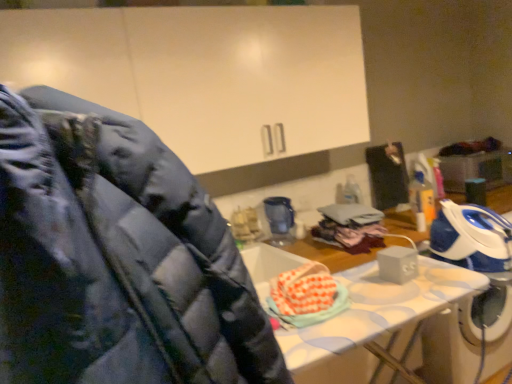
You are a GUI agent. You are given a task and a screenshot of the screen. Output one action in this format:
    pyautogui.click(x=<x>, y=<y>)
    Task: Click on the blue plastic blender at center
    The image size is (512, 384).
    Given the screenshot: What is the action you would take?
    [x=279, y=220]

What do you see at coordinates (279, 220) in the screenshot?
I see `blue plastic blender at center` at bounding box center [279, 220].

Locate an element on the screen. Image resolution: width=512 pixels, height=384 pixels. black fabric suit at upper right is located at coordinates (387, 175).

What is the approximate width of black fabric suit at upper right?

The width of black fabric suit at upper right is 5.65 inches.

What do you see at coordinates (387, 175) in the screenshot?
I see `black fabric suit at upper right` at bounding box center [387, 175].

I want to click on blue plastic blender at center, so click(279, 220).

Considering the positions of objects blue plastic blender at center and black fabric suit at upper right in the image provided, who is more to the left, blue plastic blender at center or black fabric suit at upper right?

blue plastic blender at center.

Is blue plastic blender at center in front of black fabric suit at upper right?

Yes, blue plastic blender at center is closer to the viewer.

Which is in front, point (272, 233) or point (396, 168)?

Positioned in front is point (272, 233).

From the image's perspective, is blue plastic blender at center located above or below black fabric suit at upper right?

blue plastic blender at center is below black fabric suit at upper right.

From a real-world perspective, who is located lower, blue plastic blender at center or black fabric suit at upper right?

In real-world perspective, blue plastic blender at center is lower.

Can you confirm if blue plastic blender at center is thinner than black fabric suit at upper right?

No.

Can you confirm if blue plastic blender at center is shorter than black fabric suit at upper right?

Yes.

Between blue plastic blender at center and black fabric suit at upper right, which one has smaller size?

Smaller between the two is blue plastic blender at center.

Does blue plastic blender at center contain black fabric suit at upper right?

No, black fabric suit at upper right is not inside blue plastic blender at center.

Is blue plastic blender at center positioned far away from black fabric suit at upper right?

blue plastic blender at center is near black fabric suit at upper right, not far away.

Is blue plastic blender at center oriented towards black fabric suit at upper right?

No, blue plastic blender at center does not turn towards black fabric suit at upper right.

How many degrees apart are the facing directions of blue plastic blender at center and black fabric suit at upper right?

The angle between the facing direction of blue plastic blender at center and the facing direction of black fabric suit at upper right is 4.73 degrees.

I want to click on person lying behind the blue plastic blender at center, so click(387, 175).

Based on the photo, which object is positioned more to the right, black fabric suit at upper right or blue plastic blender at center?

black fabric suit at upper right.

Relative to blue plastic blender at center, is black fabric suit at upper right in front or behind?

Clearly, black fabric suit at upper right is behind blue plastic blender at center.

Is point (405, 168) farther from viewer compared to point (290, 228)?

That is True.

From the image's perspective, does black fabric suit at upper right appear higher than blue plastic blender at center?

Correct, black fabric suit at upper right appears higher than blue plastic blender at center in the image.

From a real-world perspective, who is located higher, black fabric suit at upper right or blue plastic blender at center?

In real-world perspective, black fabric suit at upper right is above.

Does black fabric suit at upper right have a lesser width compared to blue plastic blender at center?

Yes, black fabric suit at upper right is thinner than blue plastic blender at center.

From their relative heights in the image, would you say black fabric suit at upper right is taller or shorter than blue plastic blender at center?

black fabric suit at upper right is taller than blue plastic blender at center.

Considering the relative sizes of black fabric suit at upper right and blue plastic blender at center in the image provided, is black fabric suit at upper right bigger than blue plastic blender at center?

Indeed, black fabric suit at upper right has a larger size compared to blue plastic blender at center.

Is blue plastic blender at center surrounded by black fabric suit at upper right?

No, blue plastic blender at center is not surrounded by black fabric suit at upper right.

Is the surface of black fabric suit at upper right in direct contact with blue plastic blender at center?

black fabric suit at upper right is not next to blue plastic blender at center, and they're not touching.

Is black fabric suit at upper right oriented towards blue plastic blender at center?

No.

Where is `person that is above the blue plastic blender at center (from the image's perspective)`? person that is above the blue plastic blender at center (from the image's perspective) is located at coordinates pyautogui.click(x=387, y=175).

Find the location of a particular element. Image resolution: width=512 pixels, height=384 pixels. person above the blue plastic blender at center (from the image's perspective) is located at coordinates 387,175.

In order to click on person behind the blue plastic blender at center in this screenshot , I will do `click(387, 175)`.